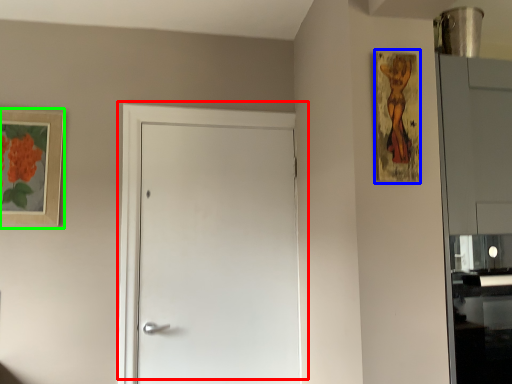
Question: Considering the real-world distances, which object is farthest from door (highlighted by a red box)? picture frame (highlighted by a blue box) or picture frame (highlighted by a green box)?

Choices:
 (A) picture frame
 (B) picture frame

Answer: (A)